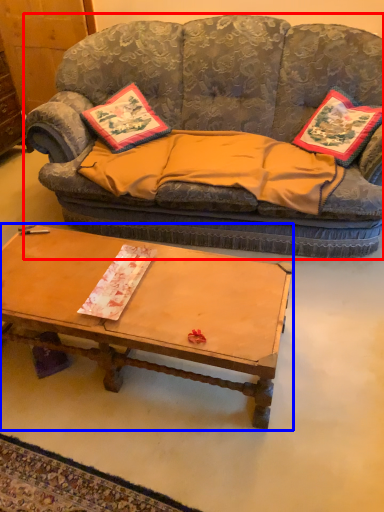
Question: Which object appears closest to the camera in this image, studio couch (highlighted by a red box) or coffee table (highlighted by a blue box)?

Choices:
 (A) studio couch
 (B) coffee table

Answer: (B)